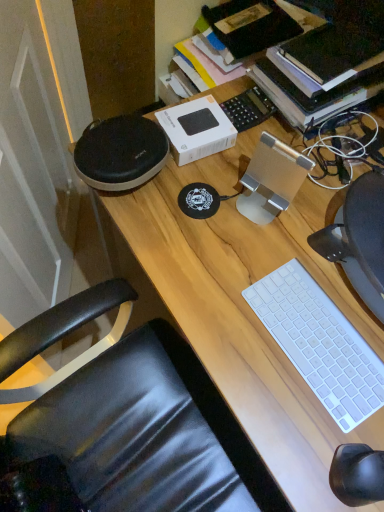
Question: Is white plastic keyboard at lower right bigger than wooden desk at center?

Choices:
 (A) yes
 (B) no

Answer: (B)

Question: Considering the relative sizes of white plastic keyboard at lower right and wooden desk at center in the image provided, is white plastic keyboard at lower right smaller than wooden desk at center?

Choices:
 (A) no
 (B) yes

Answer: (B)

Question: Is the position of white plastic keyboard at lower right less distant than that of wooden desk at center?

Choices:
 (A) yes
 (B) no

Answer: (B)

Question: Can you confirm if white plastic keyboard at lower right is thinner than wooden desk at center?

Choices:
 (A) yes
 (B) no

Answer: (A)

Question: Could you tell me if white plastic keyboard at lower right is facing wooden desk at center?

Choices:
 (A) no
 (B) yes

Answer: (A)

Question: Can you confirm if white plastic keyboard at lower right is positioned to the left of wooden desk at center?

Choices:
 (A) yes
 (B) no

Answer: (A)

Question: Would you say wooden desk at center contains white plastic keyboard at lower right?

Choices:
 (A) no
 (B) yes

Answer: (B)

Question: Does wooden desk at center have a lesser width compared to white plastic keyboard at lower right?

Choices:
 (A) no
 (B) yes

Answer: (A)

Question: Does wooden desk at center have a lesser height compared to white plastic keyboard at lower right?

Choices:
 (A) no
 (B) yes

Answer: (A)

Question: Is wooden desk at center not within white plastic keyboard at lower right?

Choices:
 (A) yes
 (B) no

Answer: (A)

Question: Considering the relative positions of wooden desk at center and white plastic keyboard at lower right in the image provided, is wooden desk at center to the right of white plastic keyboard at lower right from the viewer's perspective?

Choices:
 (A) no
 (B) yes

Answer: (B)

Question: Are wooden desk at center and white plastic keyboard at lower right far apart?

Choices:
 (A) yes
 (B) no

Answer: (B)

Question: Is wooden desk at center inside or outside of white plastic keyboard at lower right?

Choices:
 (A) inside
 (B) outside

Answer: (B)